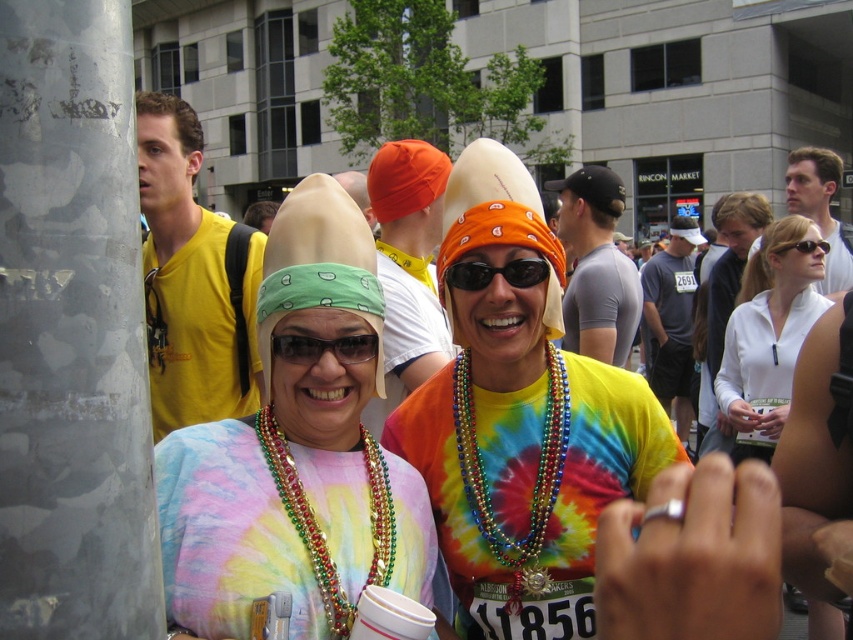
Which is behind, point (485, 280) or point (788, 248)?

Point (788, 248)

The height and width of the screenshot is (640, 853). I want to click on orange fabric bandana at center, so click(495, 273).

Which is more to the right, white zip-up sleeveless top at upper right or orange fabric bandana at center?

Positioned to the right is white zip-up sleeveless top at upper right.

What do you see at coordinates (769, 337) in the screenshot?
I see `white zip-up sleeveless top at upper right` at bounding box center [769, 337].

Where is `white zip-up sleeveless top at upper right`? The image size is (853, 640). white zip-up sleeveless top at upper right is located at coordinates (769, 337).

Find the location of a particular element. This screenshot has height=640, width=853. white zip-up sleeveless top at upper right is located at coordinates (769, 337).

Is point (368, 224) in front of point (822, 241)?

No, (368, 224) is further to viewer.

Does point (370, 218) lie in front of point (808, 246)?

No, it is not.

You are a GUI agent. You are given a task and a screenshot of the screen. Output one action in this format:
    pyautogui.click(x=<x>, y=<y>)
    Task: Click on the orange fabric hat at center
    The image size is (853, 640).
    Given the screenshot: What is the action you would take?
    pyautogui.click(x=357, y=193)